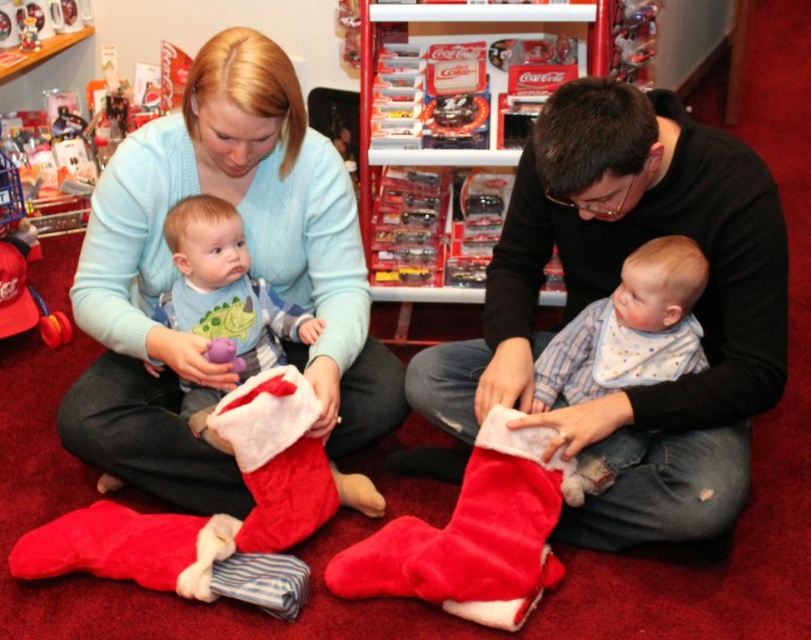
Question: Can you confirm if matte blue sweater at upper left is bigger than matte purple plush toy at center?

Choices:
 (A) yes
 (B) no

Answer: (A)

Question: Which object is the farthest from the matte plush baby at center?

Choices:
 (A) fuzzy red stocking at lower center
 (B) soft white bib at center

Answer: (B)

Question: From the image, what is the correct spatial relationship of fuzzy red stocking at lower center in relation to matte purple plush toy at center?

Choices:
 (A) left
 (B) right

Answer: (B)

Question: Which point is farther to the camera?

Choices:
 (A) matte blue sweater at upper left
 (B) velvet red stocking at lower center
 (C) fuzzy red stocking at lower center

Answer: (C)

Question: Which point is closer to the camera?

Choices:
 (A) click(398, 388)
 (B) click(174, 243)

Answer: (B)

Question: Does matte blue sweater at upper left have a greater width compared to fuzzy red stocking at lower center?

Choices:
 (A) no
 (B) yes

Answer: (B)